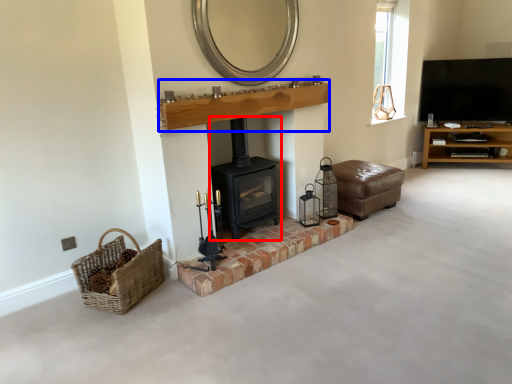
Question: Among these objects, which one is nearest to the camera, wood burning stove (highlighted by a red box) or mantle (highlighted by a blue box)?

Choices:
 (A) wood burning stove
 (B) mantle

Answer: (B)